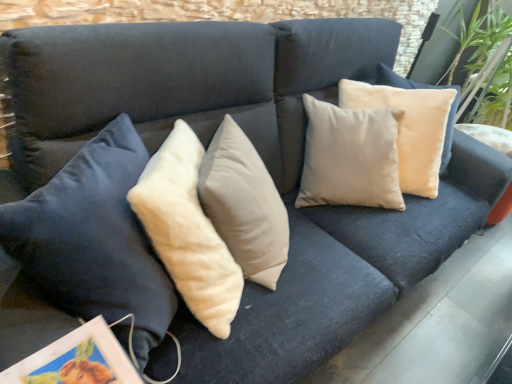
Locate an element on the screen. free spot above matte white picture frame at lower left (from a real-world perspective) is located at coordinates (76, 364).